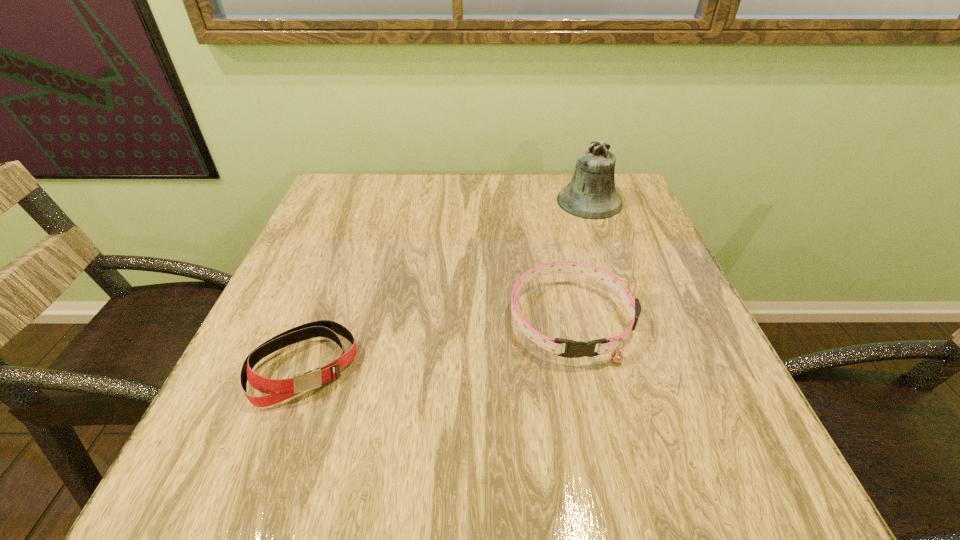
You are a GUI agent. You are given a task and a screenshot of the screen. Output one action in this format:
    pyautogui.click(x=<x>, y=<y>)
    Task: Click on the bell
    The height and width of the screenshot is (540, 960).
    Given the screenshot: What is the action you would take?
    pyautogui.click(x=591, y=194)

Image resolution: width=960 pixels, height=540 pixels. Identify the location of the tallest object. [591, 194].

This screenshot has height=540, width=960. Identify the location of the right dog collar. (574, 349).

At what (x,y) coordinates should I click in order to perform the action: click on the left dog collar. Please return your answer as a coordinate pair (x, y). Looking at the image, I should click on (277, 390).

Locate an element on the screen. The image size is (960, 540). free region located on the left of the farthest object is located at coordinates (505, 201).

I want to click on vacant region located 0.210m with the buckle on the right dog collar, so click(607, 489).

Locate an element on the screen. This screenshot has height=540, width=960. free space located 0.140m on the front of the left dog collar is located at coordinates pyautogui.click(x=254, y=500).

You are a GUI agent. You are given a task and a screenshot of the screen. Output one action in this format:
    pyautogui.click(x=<x>, y=<y>)
    Task: Click on the object positioned at the far edge
    The height and width of the screenshot is (540, 960).
    Given the screenshot: What is the action you would take?
    pyautogui.click(x=591, y=194)

Find the location of a particular element. This screenshot has width=960, height=540. object present at the left edge is located at coordinates coord(277,390).

Find the location of a particular element. The width and height of the screenshot is (960, 540). bell that is positioned at the right edge is located at coordinates (591, 194).